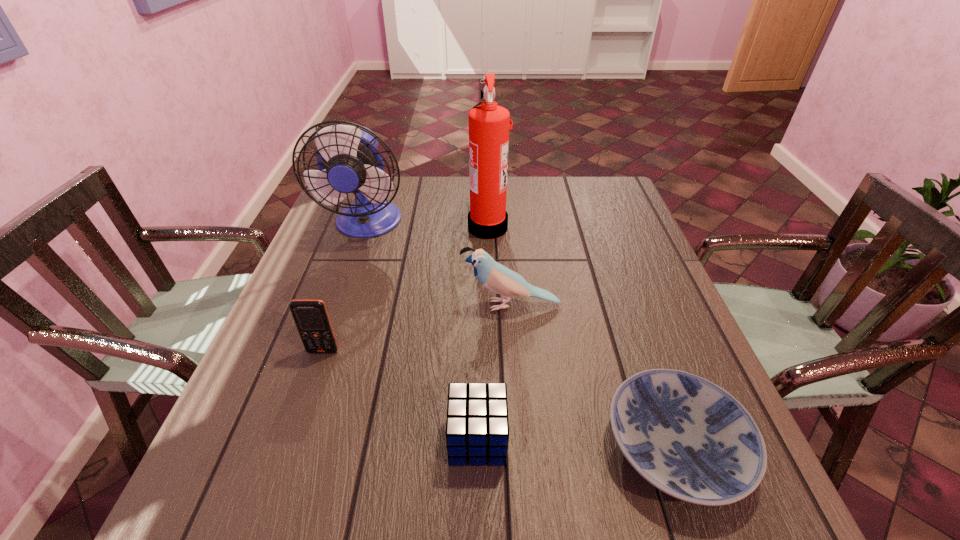
You are a GUI agent. You are given a task and a screenshot of the screen. Output one action in this format:
    pyautogui.click(x=<x>, y=<y>)
    Task: Click on the free space in the image that satisfies the following two spatial constraints: 1. on the screen of the second shortest object; 2. on the left side of the fourth farthest object
    
    Given the screenshot: What is the action you would take?
    pyautogui.click(x=293, y=439)